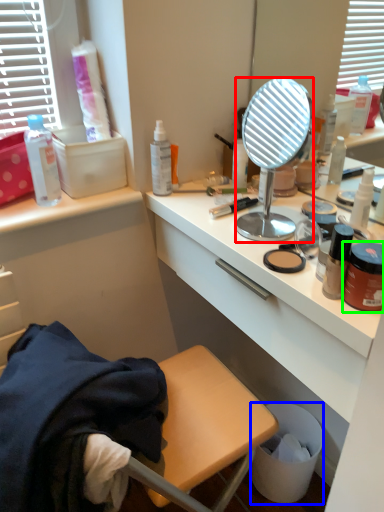
Question: Which is nearer to the mirror (highlighted by a red box)? trash bin/can (highlighted by a blue box) or cosmetic (highlighted by a green box).

Choices:
 (A) trash bin/can
 (B) cosmetic

Answer: (B)